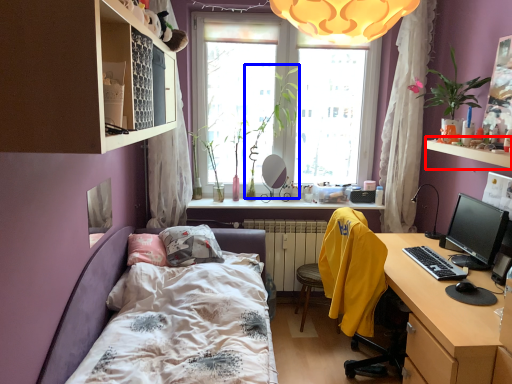
Question: Which point is closer to the camera, window sill (highlighted by a red box) or plant (highlighted by a blue box)?

Choices:
 (A) window sill
 (B) plant

Answer: (A)